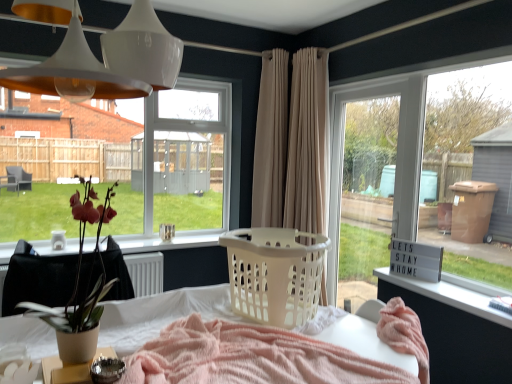
Question: Is white glossy pendant lights at upper center bigger or smaller than white plastic changing table at lower right?

Choices:
 (A) big
 (B) small

Answer: (A)

Question: From the image's perspective, is white glossy pendant lights at upper center positioned above or below white plastic changing table at lower right?

Choices:
 (A) below
 (B) above

Answer: (B)

Question: Considering the real-world distances, which object is closest to the beige fabric curtain at center, the 2th curtain from the left?

Choices:
 (A) matte brown pot at left
 (B) white glossy pendant lights at upper center
 (C) beige fabric curtain at center, placed as the 1th curtain when sorted from left to right
 (D) clear glass window at upper left
 (E) white plastic table at lower center

Answer: (C)

Question: Which of these objects is positioned farthest from the white plastic laundry basket at center?

Choices:
 (A) white glossy pendant lights at upper center
 (B) clear glass window at upper left
 (C) matte brown pot at left
 (D) white plastic table at lower center
 (E) beige fabric curtain at center, which is counted as the first curtain, starting from the right

Answer: (B)